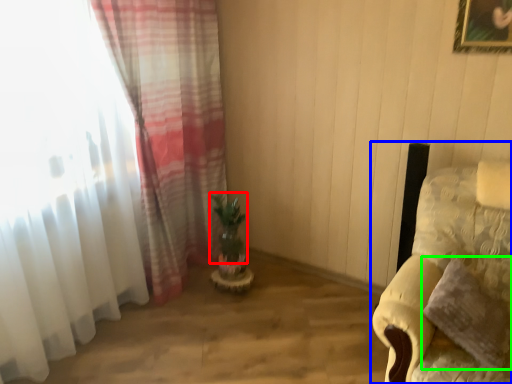
Question: Based on their relative distances, which object is farther from plant (highlighted by a red box)? Choose from furniture (highlighted by a blue box) and pillow (highlighted by a green box).

Choices:
 (A) furniture
 (B) pillow

Answer: (B)